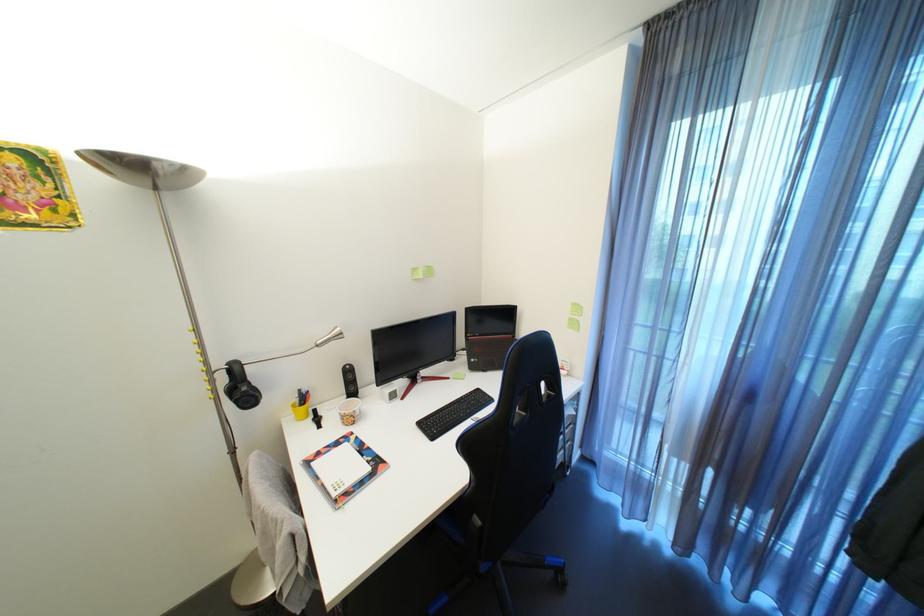
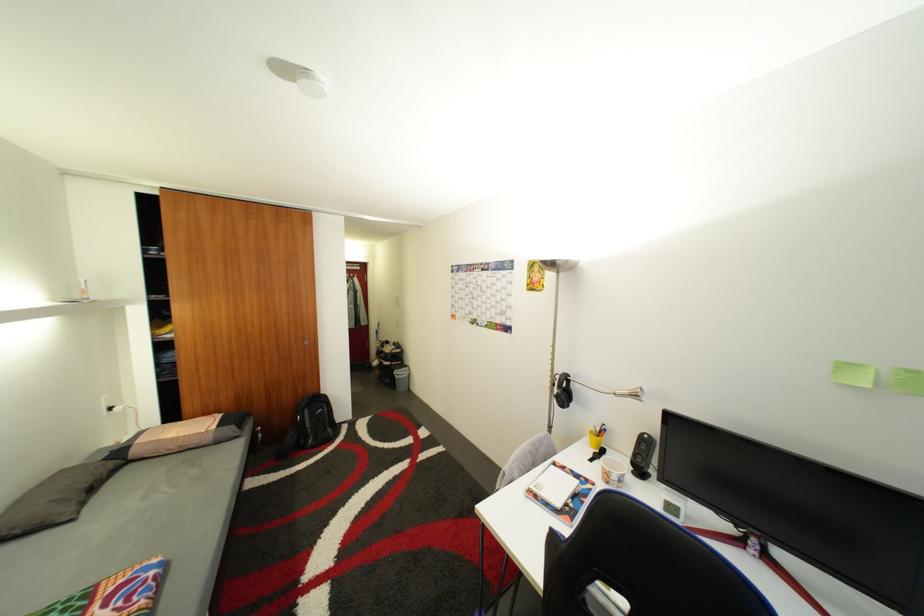
Question: The camera is either moving clockwise (left) or counter-clockwise (right) around the object. The first image is from the beginning of the video and the second image is from the end. Is the camera moving left or right when shooting the video?

Choices:
 (A) Left
 (B) Right

Answer: (B)